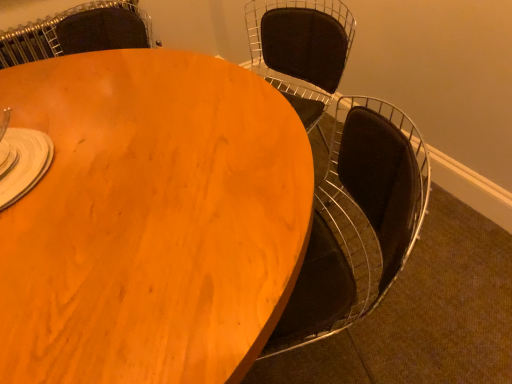
What are the coordinates of `matte wood chair at upper center, the second chair from the right` in the screenshot? It's located at (78, 32).

The height and width of the screenshot is (384, 512). What do you see at coordinates (78, 32) in the screenshot? I see `matte wood chair at upper center, the second chair from the right` at bounding box center [78, 32].

In order to face matte wood table at center, should I rotate leftwards or rightwards?

Turn left by 17.194 degrees to look at matte wood table at center.

Identify the location of matte wood chair at upper center, the first chair positioned from the left. (78, 32).

From a real-world perspective, is matte wood table at center beneath matte black chair at upper right, positioned as the 2th chair in left-to-right order?

Yes, from a real-world perspective, matte wood table at center is below matte black chair at upper right, positioned as the 2th chair in left-to-right order.

From the image's perspective, is matte wood table at center beneath matte black chair at upper right, positioned as the 2th chair in left-to-right order?

Yes, from the image's perspective, matte wood table at center is beneath matte black chair at upper right, positioned as the 2th chair in left-to-right order.

Can you confirm if matte wood table at center is smaller than matte black chair at upper right, positioned as the 2th chair in left-to-right order?

Actually, matte wood table at center might be larger than matte black chair at upper right, positioned as the 2th chair in left-to-right order.

Is matte wood table at center far away from matte black chair at upper right, which is the 1th chair from right to left?

No, matte wood table at center is in close proximity to matte black chair at upper right, which is the 1th chair from right to left.

How distant is matte wood table at center from matte wood chair at upper center, the first chair positioned from the left?

The distance of matte wood table at center from matte wood chair at upper center, the first chair positioned from the left, is 37.94 inches.

Consider the image. Is matte wood table at center with matte wood chair at upper center, the second chair from the right?

No, matte wood table at center is not with matte wood chair at upper center, the second chair from the right.

Consider the image. Is matte wood table at center facing away from matte wood chair at upper center, the first chair positioned from the left?

No, matte wood chair at upper center, the first chair positioned from the left, is not at the back of matte wood table at center.

Is point (52, 68) farther from camera compared to point (18, 57)?

That is False.

Which is in front, matte wood chair at upper center, the first chair positioned from the left, or matte black chair at upper right, positioned as the 2th chair in left-to-right order?

Positioned in front is matte black chair at upper right, positioned as the 2th chair in left-to-right order.

Does matte wood chair at upper center, the second chair from the right, have a smaller size compared to matte black chair at upper right, positioned as the 2th chair in left-to-right order?

Yes, matte wood chair at upper center, the second chair from the right, is smaller than matte black chair at upper right, positioned as the 2th chair in left-to-right order.

Is matte black chair at upper right, which is the 1th chair from right to left, at the back of matte wood chair at upper center, the second chair from the right?

No, matte black chair at upper right, which is the 1th chair from right to left, is not at the back of matte wood chair at upper center, the second chair from the right.

Considering the sizes of matte wood chair at upper center, the second chair from the right, and matte black chair at upper right, which is the 1th chair from right to left, in the image, is matte wood chair at upper center, the second chair from the right, wider or thinner than matte black chair at upper right, which is the 1th chair from right to left,?

Clearly, matte wood chair at upper center, the second chair from the right, has more width compared to matte black chair at upper right, which is the 1th chair from right to left.

From the image's perspective, is matte wood chair at upper center, the first chair positioned from the left, under matte wood table at center?

No, from the image's perspective, matte wood chair at upper center, the first chair positioned from the left, is not beneath matte wood table at center.

Does point (88, 50) come in front of point (291, 234)?

No, it is not.

Looking at this image, from a real-world perspective, who is located higher, matte wood chair at upper center, the first chair positioned from the left, or matte wood table at center?

matte wood chair at upper center, the first chair positioned from the left, is physically above.

Is matte black chair at upper right, which is the 1th chair from right to left, facing towards matte wood chair at upper center, the first chair positioned from the left?

No, matte black chair at upper right, which is the 1th chair from right to left, does not turn towards matte wood chair at upper center, the first chair positioned from the left.

How distant is matte black chair at upper right, positioned as the 2th chair in left-to-right order, from matte wood chair at upper center, the second chair from the right?

matte black chair at upper right, positioned as the 2th chair in left-to-right order, is 28.18 inches from matte wood chair at upper center, the second chair from the right.

Between matte black chair at upper right, which is the 1th chair from right to left, and matte wood chair at upper center, the first chair positioned from the left, which one has smaller width?

With smaller width is matte black chair at upper right, which is the 1th chair from right to left.

Is point (303, 109) closer or farther from the camera than point (132, 32)?

Point (303, 109) is positioned closer to the camera compared to point (132, 32).

I want to click on table lying in front of the matte black chair at upper right, which is the 1th chair from right to left, so click(150, 220).

From a real-world perspective, is matte black chair at upper right, which is the 1th chair from right to left, positioned above or below matte wood table at center?

matte black chair at upper right, which is the 1th chair from right to left, is situated higher than matte wood table at center in the real world.

Is matte black chair at upper right, which is the 1th chair from right to left, in front of or behind matte wood table at center in the image?

matte black chair at upper right, which is the 1th chair from right to left, is behind matte wood table at center.

This screenshot has width=512, height=384. Find the location of `table in front of the matte black chair at upper right, positioned as the 2th chair in left-to-right order`. table in front of the matte black chair at upper right, positioned as the 2th chair in left-to-right order is located at coordinates (150, 220).

From the image's perspective, which chair is the 2nd one above the matte wood table at center? Please provide its 2D coordinates.

[(78, 32)]

Which object lies nearer to the anchor point matte wood table at center, matte black chair at upper right, which is the 1th chair from right to left, or matte wood chair at upper center, the second chair from the right?

Among the two, matte black chair at upper right, which is the 1th chair from right to left, is located nearer to matte wood table at center.

Which object lies further to the anchor point matte black chair at upper right, positioned as the 2th chair in left-to-right order, matte wood chair at upper center, the second chair from the right, or matte wood table at center?

The object further to matte black chair at upper right, positioned as the 2th chair in left-to-right order, is matte wood table at center.

Based on their spatial positions, is matte wood chair at upper center, the second chair from the right, or matte black chair at upper right, positioned as the 2th chair in left-to-right order, closer to matte wood table at center?

Among the two, matte black chair at upper right, positioned as the 2th chair in left-to-right order, is located nearer to matte wood table at center.

Estimate the real-world distances between objects in this image. Which object is further from matte wood chair at upper center, the second chair from the right, matte black chair at upper right, positioned as the 2th chair in left-to-right order, or matte wood table at center?

matte wood table at center lies further to matte wood chair at upper center, the second chair from the right, than the other object.

Based on the photo, from the image, which object appears to be farther from matte black chair at upper right, positioned as the 2th chair in left-to-right order, matte wood table at center or matte wood chair at upper center, the first chair positioned from the left?

Among the two, matte wood table at center is located further to matte black chair at upper right, positioned as the 2th chair in left-to-right order.

In the scene shown: Looking at the image, which one is located closer to matte wood chair at upper center, the first chair positioned from the left, matte wood table at center or matte black chair at upper right, which is the 1th chair from right to left?

matte black chair at upper right, which is the 1th chair from right to left, is closer to matte wood chair at upper center, the first chair positioned from the left.

The width and height of the screenshot is (512, 384). Find the location of `chair between matte wood table at center and matte wood chair at upper center, the second chair from the right, in the front-back direction`. chair between matte wood table at center and matte wood chair at upper center, the second chair from the right, in the front-back direction is located at coordinates (301, 50).